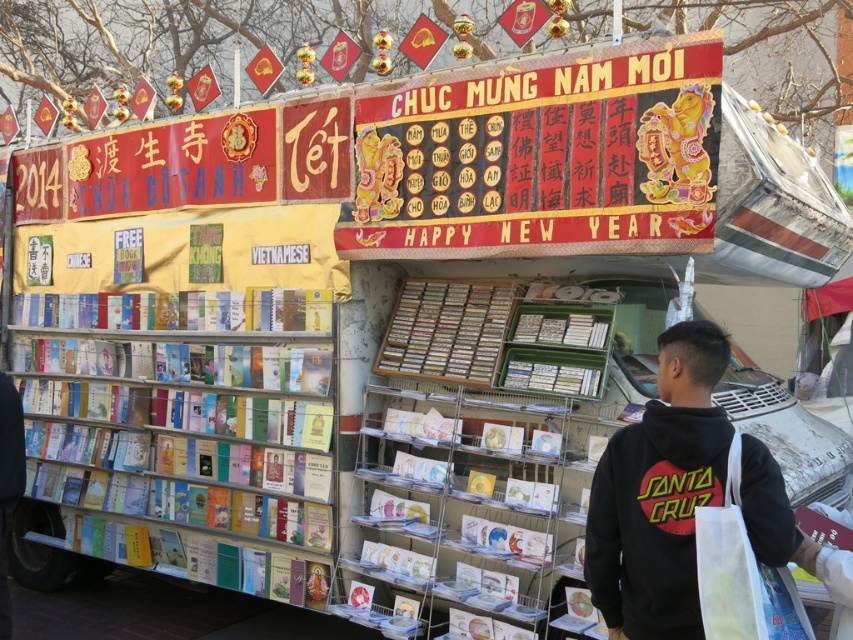
You are standing in front of the Tet street stall and notice two points marked on the decorations. The first point is at coordinates point (173, 435) and the second is at point (701, 417). Which point is closer to you?

Point (173, 435) is further to the camera than point (701, 417), so the second point is closer to you.

You are a customer standing in front of the festive Tet street stall. You see the white plastic bookshelf at left and the black cotton hoodie at center. Which item is closer to you?

The white plastic bookshelf at left is closer to you since it is further to the viewer than the black cotton hoodie at center, meaning it appears nearer in the image.